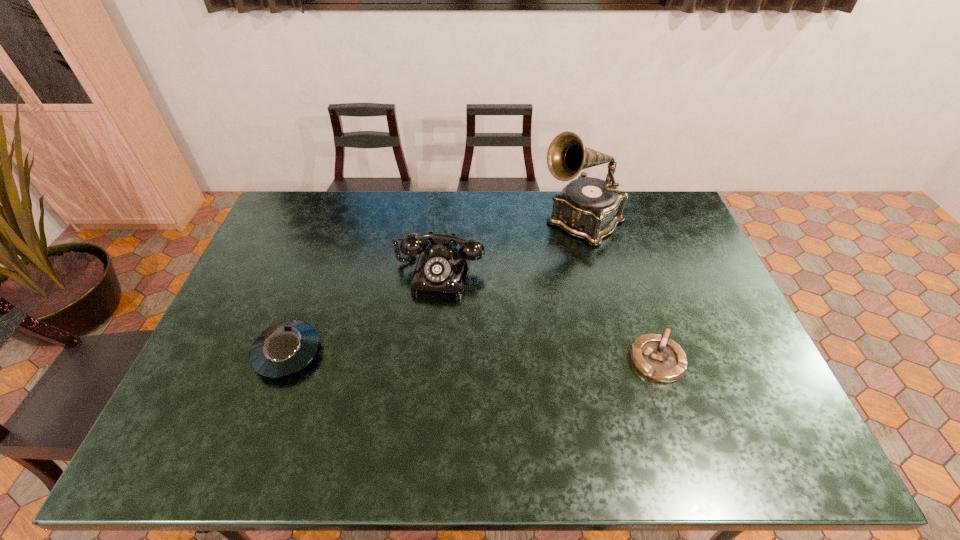
This screenshot has width=960, height=540. Find the location of `vacant space located on the dial of the second tallest object`. vacant space located on the dial of the second tallest object is located at coordinates (428, 314).

Where is `vacant space situated on the horn of the phonograph record`? This screenshot has width=960, height=540. vacant space situated on the horn of the phonograph record is located at coordinates (493, 297).

I want to click on vacant area situated on the horn of the phonograph record, so click(x=502, y=289).

The image size is (960, 540). In order to click on free region located 0.110m on the horn of the phonograph record in this screenshot , I will do `click(539, 258)`.

I want to click on object that is positioned at the far edge, so click(589, 208).

Where is `object present at the near edge`? This screenshot has height=540, width=960. object present at the near edge is located at coordinates (658, 358).

This screenshot has width=960, height=540. Identify the location of object located at the left edge. (283, 349).

Where is `free region at the far edge of the desktop`? free region at the far edge of the desktop is located at coordinates (457, 225).

The height and width of the screenshot is (540, 960). Find the location of `blank area at the near edge`. blank area at the near edge is located at coordinates (315, 413).

Locate an element on the screen. The width and height of the screenshot is (960, 540). free space at the left edge of the desktop is located at coordinates (241, 380).